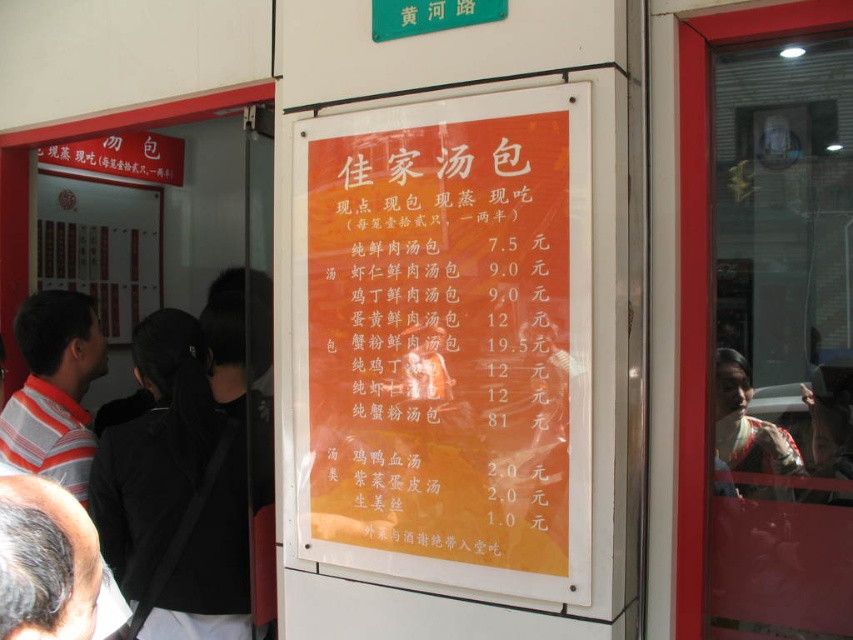
Question: Does orange paper menu at center appear over striped cotton shirt at left?

Choices:
 (A) yes
 (B) no

Answer: (A)

Question: Does orange paper menu at center have a smaller size compared to striped cotton shirt at left?

Choices:
 (A) no
 (B) yes

Answer: (A)

Question: Considering the relative positions of orange paper menu at center and striped cotton shirt at left in the image provided, where is orange paper menu at center located with respect to striped cotton shirt at left?

Choices:
 (A) right
 (B) left

Answer: (A)

Question: Which point is closer to the camera?

Choices:
 (A) (42, 435)
 (B) (297, 481)

Answer: (B)